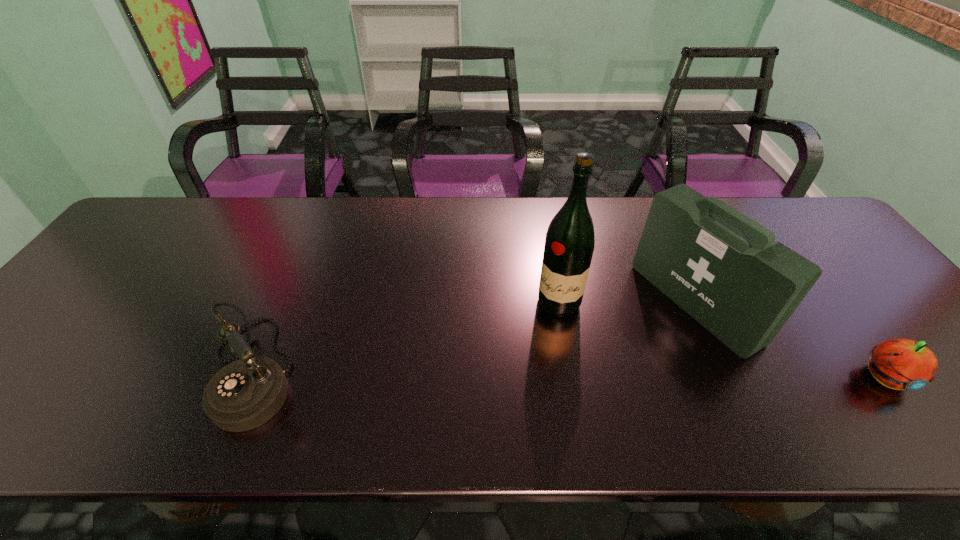
In order to click on vacant space located 0.130m on the front-facing side of the second object from right to left in this screenshot , I will do `click(620, 353)`.

Where is `vacant area situated 0.230m on the front-facing side of the second object from right to left`? vacant area situated 0.230m on the front-facing side of the second object from right to left is located at coordinates (587, 372).

The width and height of the screenshot is (960, 540). Find the location of `vacant space located on the front-facing side of the tallest object`. vacant space located on the front-facing side of the tallest object is located at coordinates (531, 360).

Identify the location of vacant space located 0.130m on the front-facing side of the tallest object. (533, 357).

Identify the location of vacant region located on the front-facing side of the tallest object. (516, 392).

The image size is (960, 540). Find the location of `telephone present at the near edge`. telephone present at the near edge is located at coordinates (246, 393).

Identify the location of apple that is at the near edge. (902, 364).

Where is `object at the right edge`? The width and height of the screenshot is (960, 540). object at the right edge is located at coordinates (902, 364).

Locate an element on the screen. The image size is (960, 540). object that is at the near right corner is located at coordinates (902, 364).

This screenshot has width=960, height=540. In the image, there is a desktop. In order to click on free space at the far edge in this screenshot , I will do `click(234, 209)`.